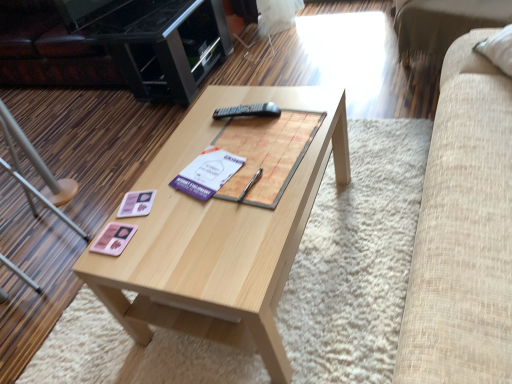
Find the location of `free space between black plastic remote at center and white paper at center`. free space between black plastic remote at center and white paper at center is located at coordinates (227, 143).